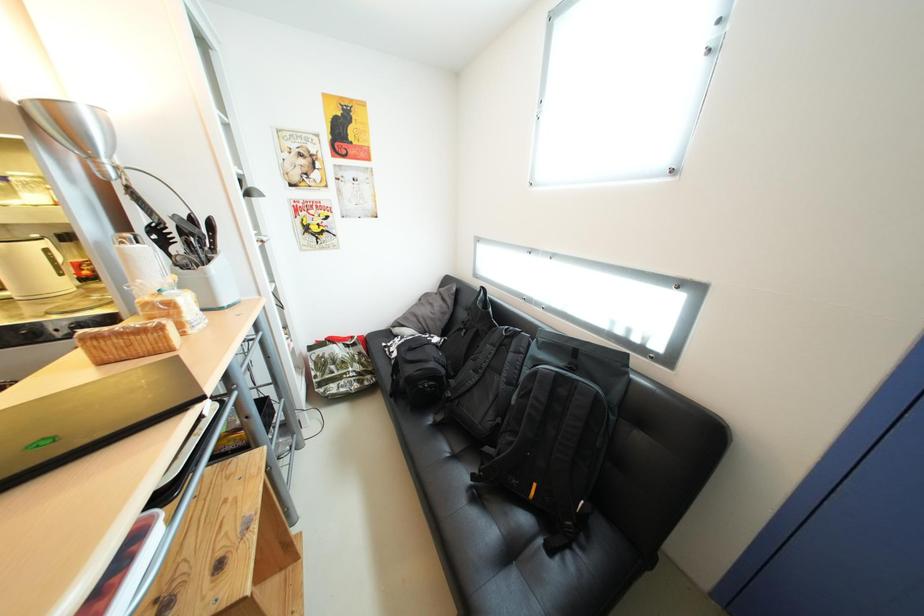
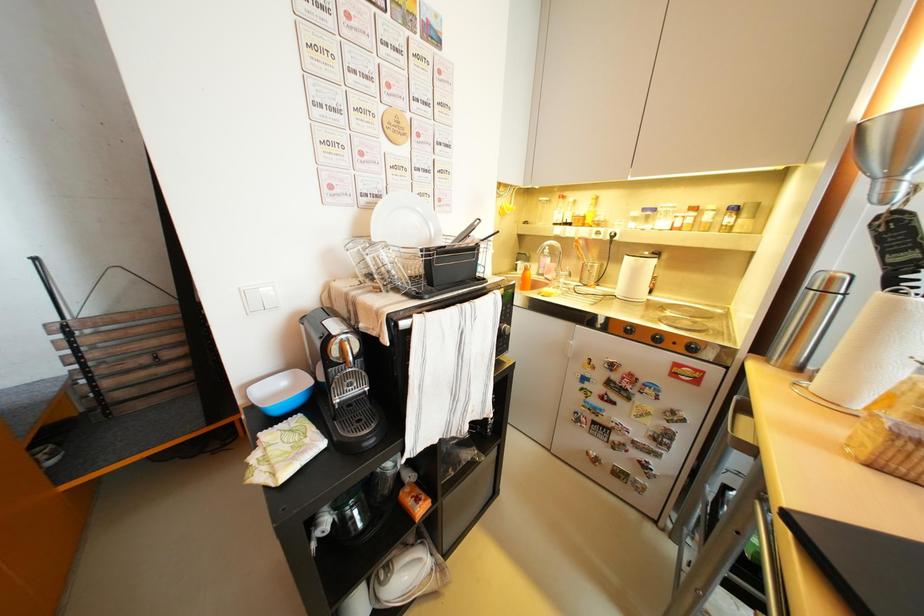
Question: How did the camera likely rotate?

Choices:
 (A) Left
 (B) Right
 (C) Up
 (D) Down

Answer: (A)